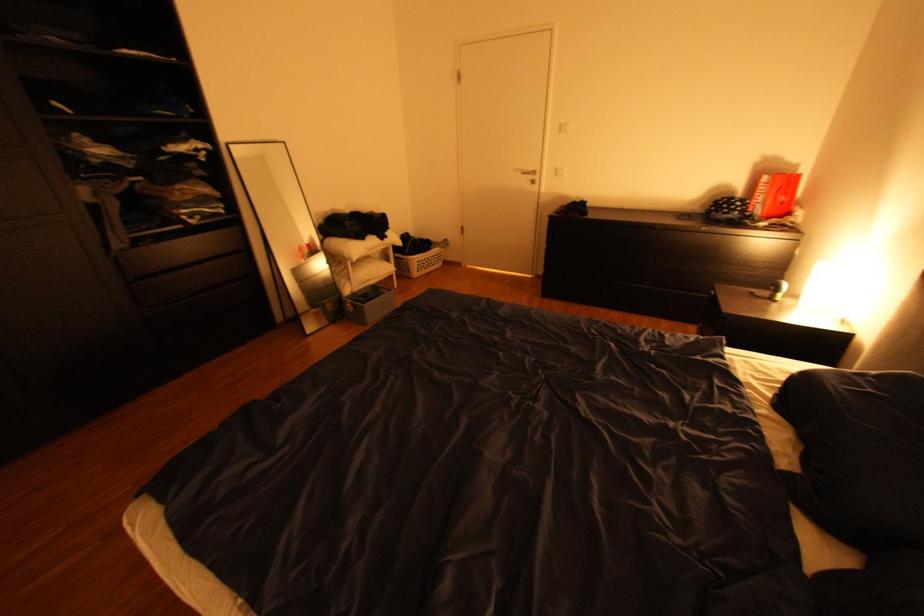
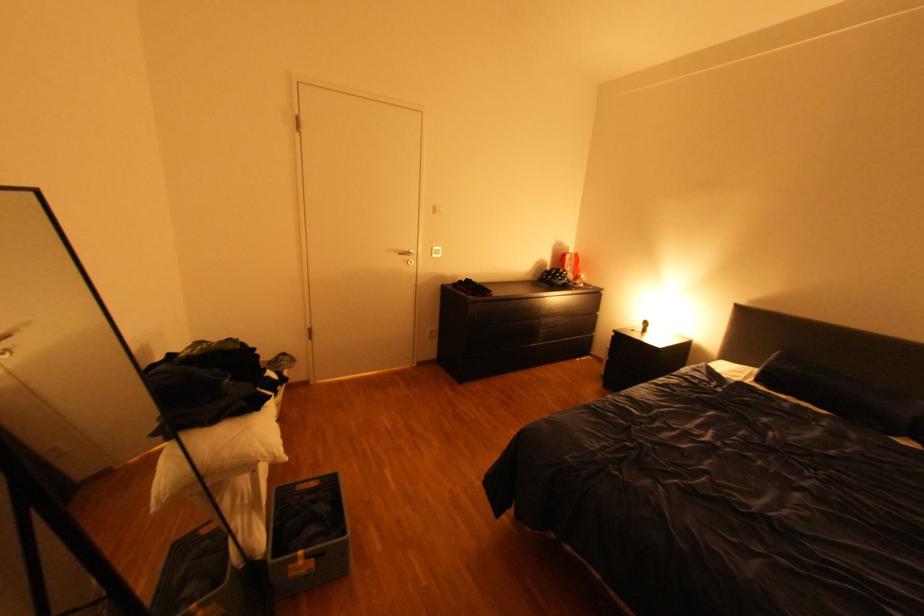
The point at (350, 236) is marked in the first image. Where is the corresponding point in the second image?

(223, 421)